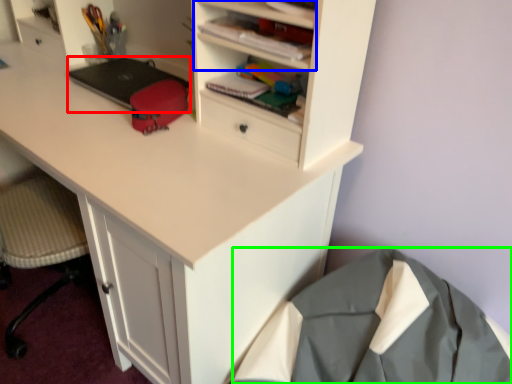
Question: Estimate the real-world distances between objects in this image. Which object is closer to laptop (highlighted by a red box), cabinet (highlighted by a blue box) or clothing (highlighted by a green box)?

Choices:
 (A) cabinet
 (B) clothing

Answer: (A)